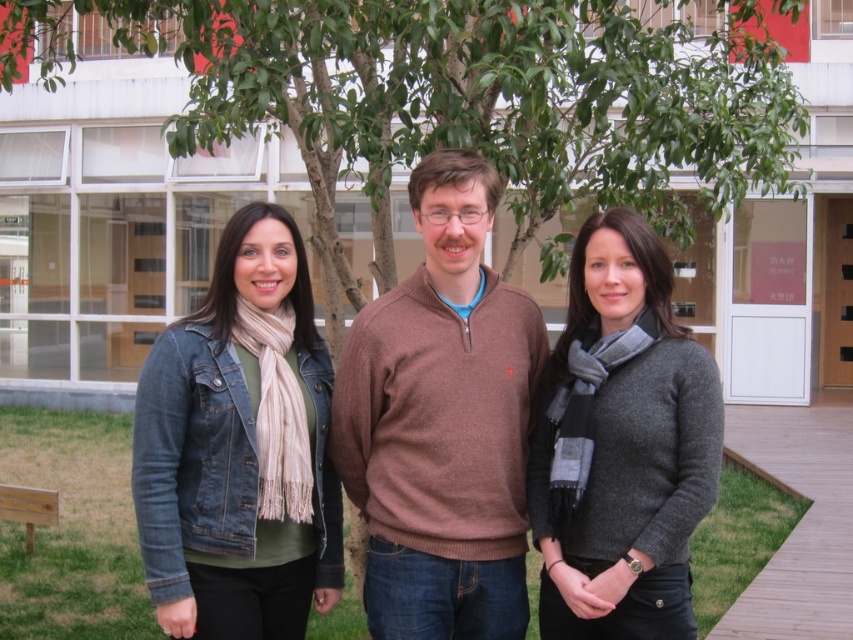
Question: Which point is closer to the camera?

Choices:
 (A) brown wool sweater at center
 (B) gray wool sweater at center
 (C) denim jacket at left

Answer: (B)

Question: Does denim jacket at center have a smaller size compared to gray wool sweater at center?

Choices:
 (A) yes
 (B) no

Answer: (B)

Question: Is denim jacket at center further to camera compared to gray wool sweater at center?

Choices:
 (A) yes
 (B) no

Answer: (A)

Question: Which point is farther to the camera?

Choices:
 (A) (256, 532)
 (B) (543, 554)
 (C) (607, 307)
 (D) (461, 348)

Answer: (B)

Question: Which of the following is the closest to the observer?

Choices:
 (A) gray wool sweater at center
 (B) denim jacket at center
 (C) brown wool sweater at center
 (D) denim jacket at left

Answer: (A)

Question: Can you confirm if denim jacket at center is bigger than denim jacket at left?

Choices:
 (A) no
 (B) yes

Answer: (B)